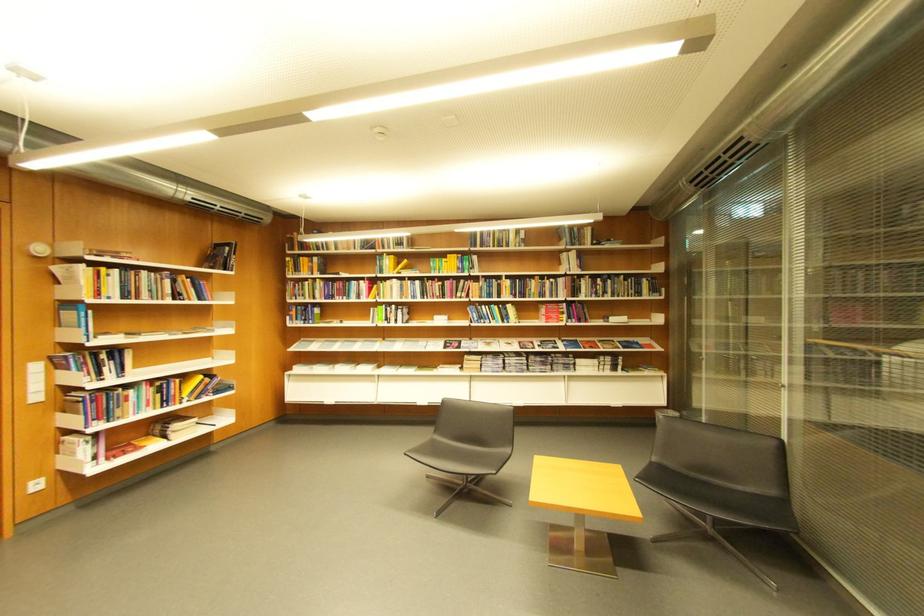
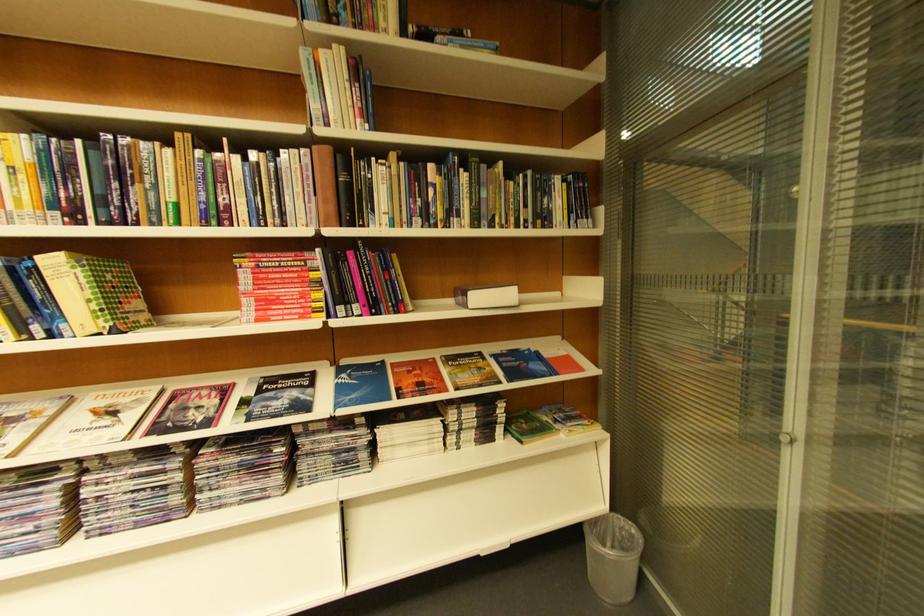
Locate, in the second image, the point that corresponds to (x=650, y=294) in the first image.

(554, 221)